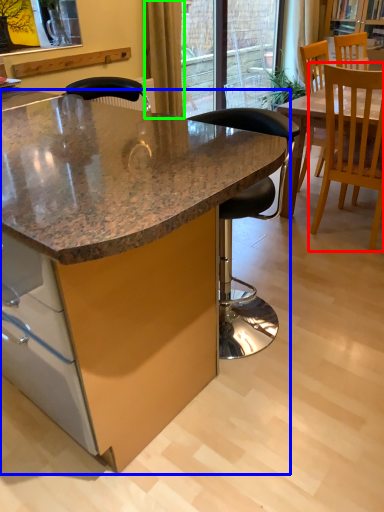
Question: Considering the real-world distances, which object is farthest from chair (highlighted by a red box)? table (highlighted by a blue box) or curtain (highlighted by a green box)?

Choices:
 (A) table
 (B) curtain

Answer: (B)